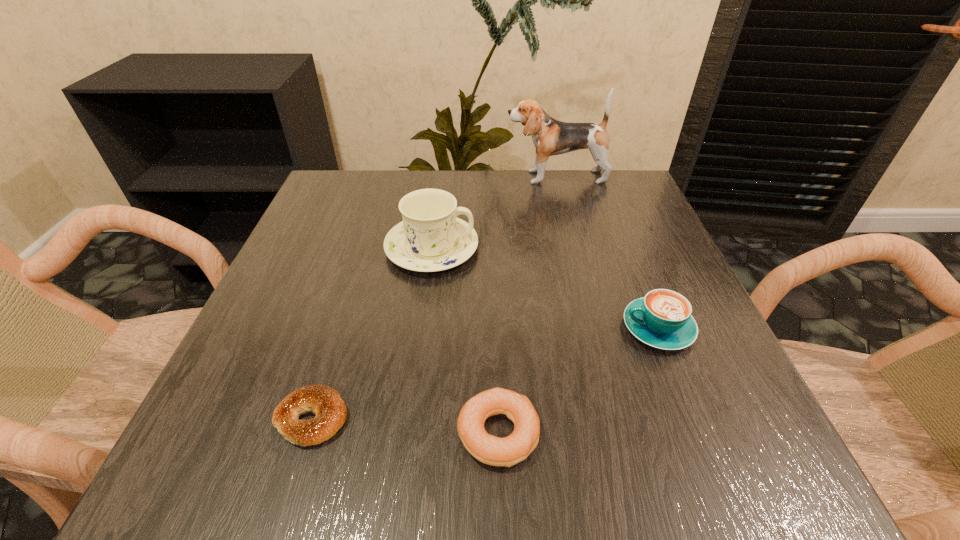
The image size is (960, 540). In order to click on free space located at the face of the tallest object in this screenshot , I will do `click(463, 177)`.

This screenshot has height=540, width=960. In order to click on vacant space located 0.240m at the face of the tallest object in this screenshot , I will do `click(412, 177)`.

What are the coordinates of `vacant point located 0.390m at the face of the tallest object` in the screenshot? It's located at (353, 177).

The width and height of the screenshot is (960, 540). What are the coordinates of `vacant space located on the handle side of the chinaware` in the screenshot? It's located at (527, 248).

In order to click on free space located 0.120m with the handle on the right side of the cappuccino in this screenshot , I will do `click(552, 328)`.

Where is `vacant space located 0.300m with the handle on the right side of the cappuccino`? This screenshot has width=960, height=540. vacant space located 0.300m with the handle on the right side of the cappuccino is located at coordinates (446, 328).

Where is `vacant space located with the handle on the right side of the cappuccino`? vacant space located with the handle on the right side of the cappuccino is located at coordinates (505, 328).

This screenshot has height=540, width=960. I want to click on free region located on the back of the fourth tallest object, so click(492, 247).

What are the coordinates of `vacant space located on the back of the shorter bagel` in the screenshot? It's located at (369, 238).

Where is `puppy situated at the far edge`? puppy situated at the far edge is located at coordinates (550, 137).